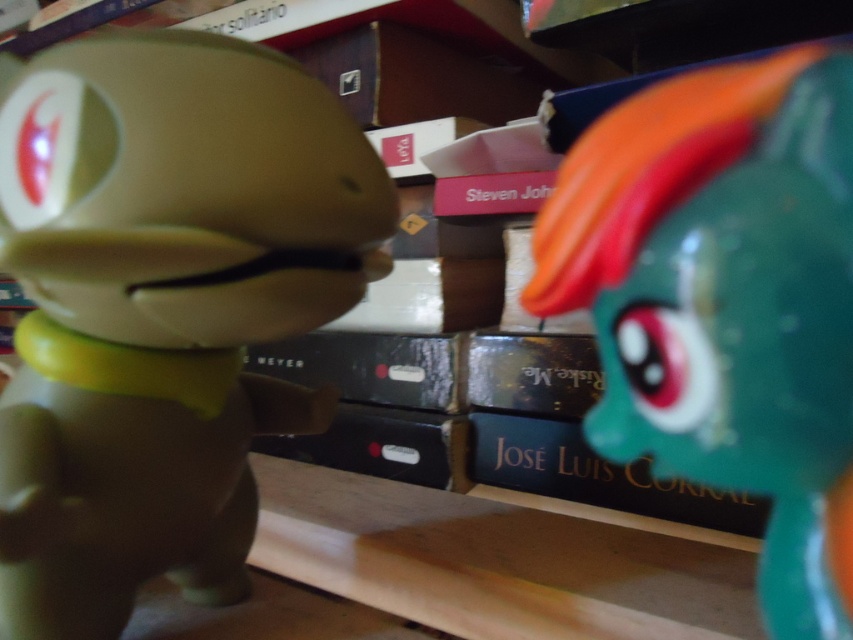
Question: Does teal rubber toy at right appear on the right side of gold textured book at center?

Choices:
 (A) no
 (B) yes

Answer: (B)

Question: Does teal rubber toy at right appear under gold textured book at center?

Choices:
 (A) no
 (B) yes

Answer: (A)

Question: Which object is positioned farthest from the teal rubber toy at right?

Choices:
 (A) matte green toy at left
 (B) gold textured book at center

Answer: (B)

Question: Which point is farther to the camera?

Choices:
 (A) matte green toy at left
 (B) teal rubber toy at right

Answer: (A)

Question: Among these objects, which one is nearest to the camera?

Choices:
 (A) teal rubber toy at right
 (B) gold textured book at center

Answer: (A)

Question: Is matte green toy at left behind gold textured book at center?

Choices:
 (A) no
 (B) yes

Answer: (A)